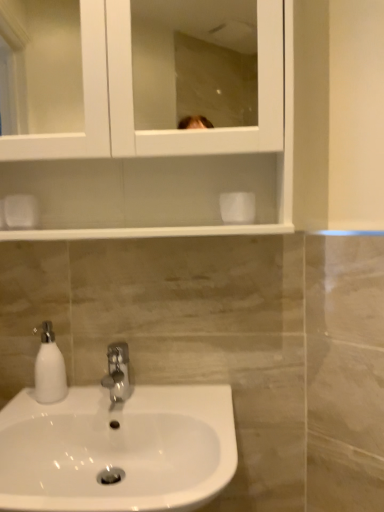
This screenshot has width=384, height=512. Find the location of `free spot to the right of polished chrome faucet at center`. free spot to the right of polished chrome faucet at center is located at coordinates tap(174, 399).